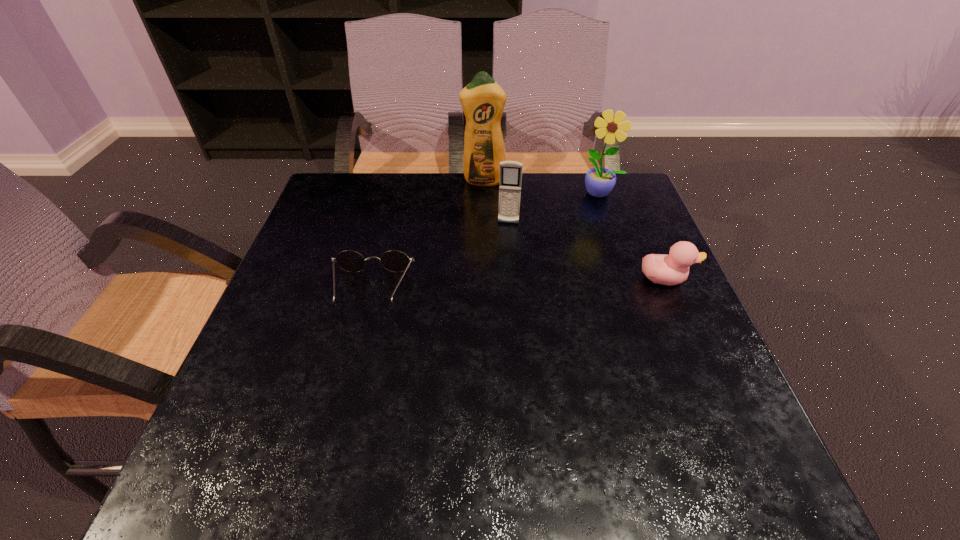
Identify the location of vacant point located 0.200m on the front-facing side of the fourth shortest object. This screenshot has height=540, width=960. (576, 244).

The image size is (960, 540). In order to click on free spot located 0.350m on the label of the tallest object in this screenshot , I will do `click(490, 272)`.

The image size is (960, 540). Identify the location of vacant point located on the label of the tallest object. (489, 260).

Identify the location of vacant region located on the label of the tallest object. (486, 212).

You are a GUI agent. You are given a task and a screenshot of the screen. Output one action in this format:
    pyautogui.click(x=<x>, y=<y>)
    Task: Click on the vacant space situated 0.220m on the front-facing side of the third farthest object
    
    Given the screenshot: What is the action you would take?
    point(499,287)

The height and width of the screenshot is (540, 960). What are the coordinates of `free space located on the front-facing side of the third farthest object` in the screenshot? It's located at (494, 322).

Where is `blank space located 0.050m on the front-facing side of the third farthest object`? blank space located 0.050m on the front-facing side of the third farthest object is located at coordinates (506, 239).

The width and height of the screenshot is (960, 540). In order to click on sunflower that is positioned at the far edge in this screenshot , I will do `click(599, 181)`.

Locate an element on the screen. This screenshot has height=540, width=960. detergent present at the far edge is located at coordinates (483, 100).

The image size is (960, 540). What are the coordinates of `cellular telephone present at the far edge` in the screenshot? It's located at (510, 171).